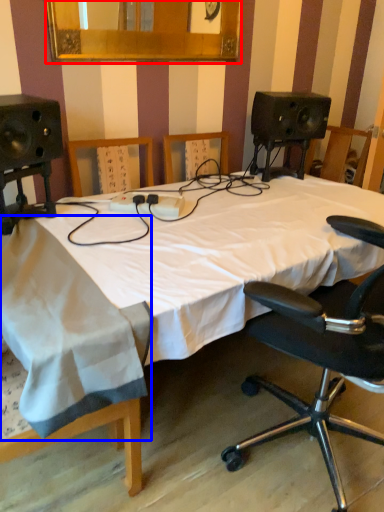
Question: Which of the following is the closest to the observer, mirror (highlighted by a red box) or sheet (highlighted by a blue box)?

Choices:
 (A) mirror
 (B) sheet

Answer: (B)